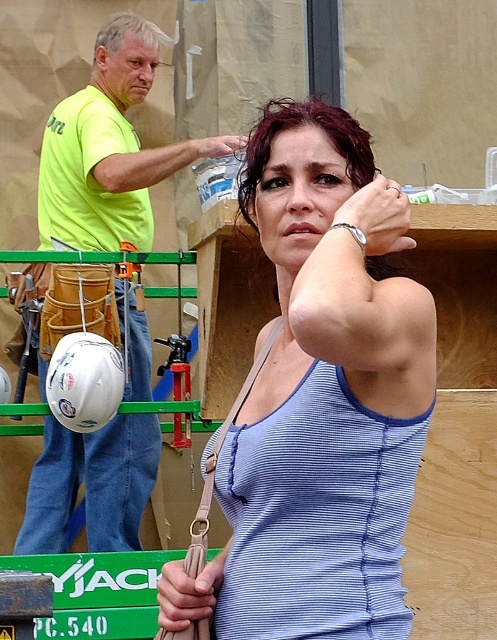
Question: Which object appears farthest from the camera in this image?

Choices:
 (A) neon yellow t-shirt at left
 (B) blue striped tank top at center

Answer: (A)

Question: Considering the relative positions of blue striped tank top at center and neon yellow t-shirt at left in the image provided, where is blue striped tank top at center located with respect to neon yellow t-shirt at left?

Choices:
 (A) right
 (B) left

Answer: (A)

Question: Is blue striped tank top at center thinner than neon yellow t-shirt at left?

Choices:
 (A) no
 (B) yes

Answer: (B)

Question: In this image, where is blue striped tank top at center located relative to neon yellow t-shirt at left?

Choices:
 (A) left
 (B) right

Answer: (B)

Question: Which of the following is the closest to the observer?

Choices:
 (A) blue striped tank top at center
 (B) neon yellow t-shirt at left

Answer: (A)